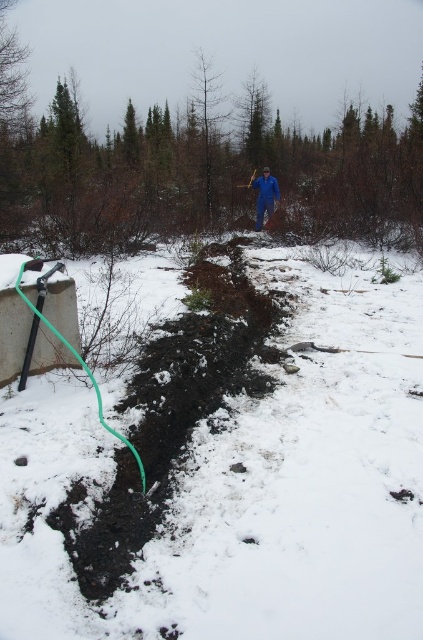
Question: Estimate the real-world distances between objects in this image. Which object is closer to the blue fabric person at center?

Choices:
 (A) green rubber garden hose at lower left
 (B) black soil at center

Answer: (B)

Question: Does black soil at center lie in front of green rubber garden hose at lower left?

Choices:
 (A) yes
 (B) no

Answer: (B)

Question: Among these objects, which one is farthest from the camera?

Choices:
 (A) black soil at center
 (B) green rubber garden hose at lower left
 (C) blue fabric person at center

Answer: (C)

Question: Is black soil at center positioned at the back of green rubber garden hose at lower left?

Choices:
 (A) no
 (B) yes

Answer: (B)

Question: Is black soil at center bigger than green rubber garden hose at lower left?

Choices:
 (A) yes
 (B) no

Answer: (A)

Question: Which point appears farthest from the camera in this image?

Choices:
 (A) (277, 186)
 (B) (19, 285)
 (C) (181, 355)

Answer: (A)